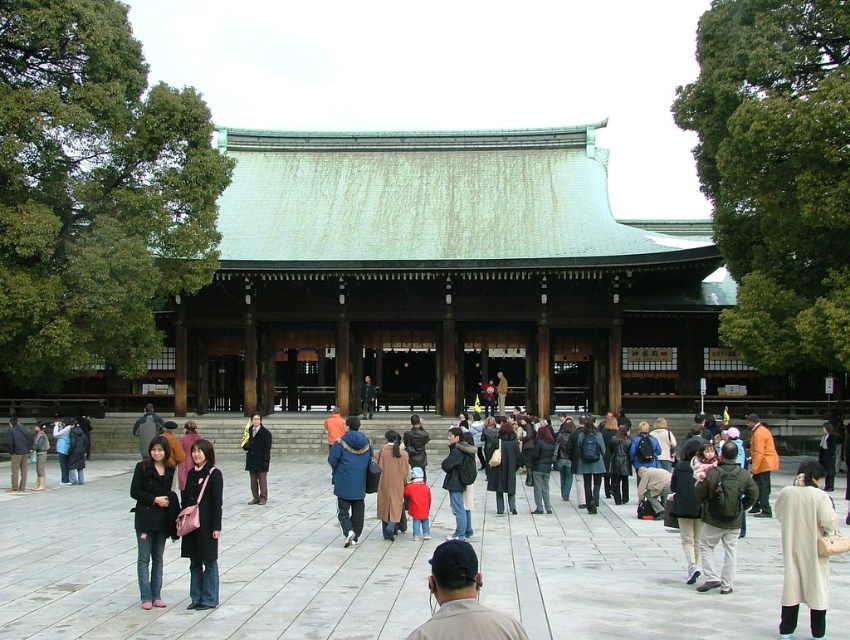
You are standing in front of the traditional Japanese shrine and see a blue denim jacket at center and a dark blue backpack at center. Which item takes up more horizontal space?

The blue denim jacket at center might be wider than dark blue backpack at center, so it likely takes up more horizontal space.

You are standing in front of the traditional Japanese shrine and notice a black leather jacket at lower left and dark blue jeans at center. Which item is positioned higher up in the image?

The black leather jacket at lower left is taller than dark blue jeans at center, so it is positioned higher up in the image.